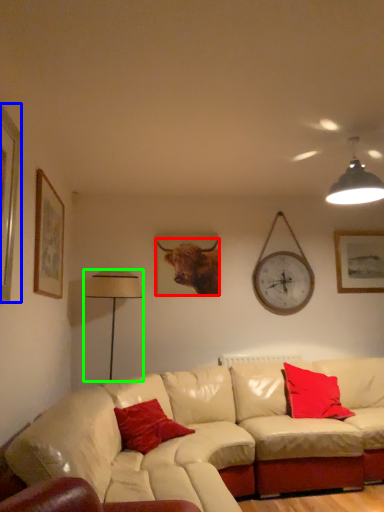
Question: Which is nearer to the cattle (highlighted by a red box)? picture frame (highlighted by a blue box) or table lamp (highlighted by a green box).

Choices:
 (A) picture frame
 (B) table lamp

Answer: (B)